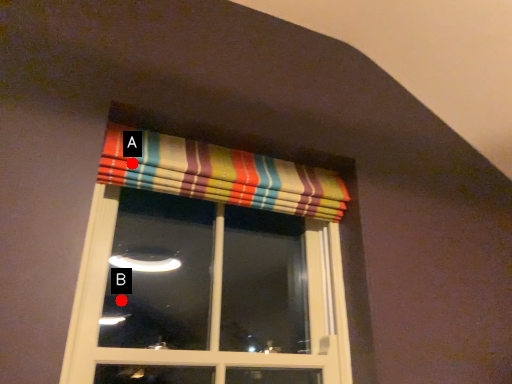
Question: Two points are circled on the image, labeled by A and B beside each circle. Which point appears closest to the camera in this image?

Choices:
 (A) A is closer
 (B) B is closer

Answer: (A)